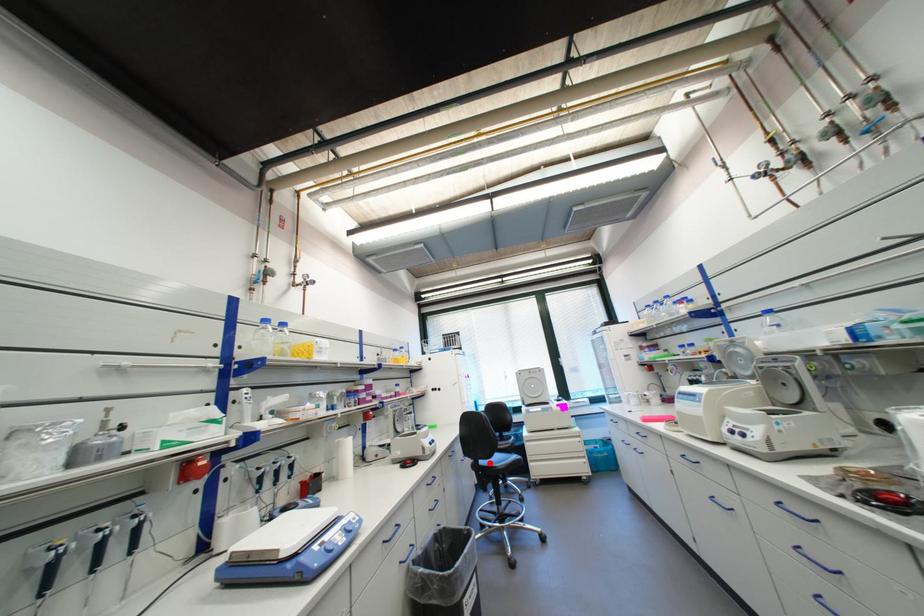
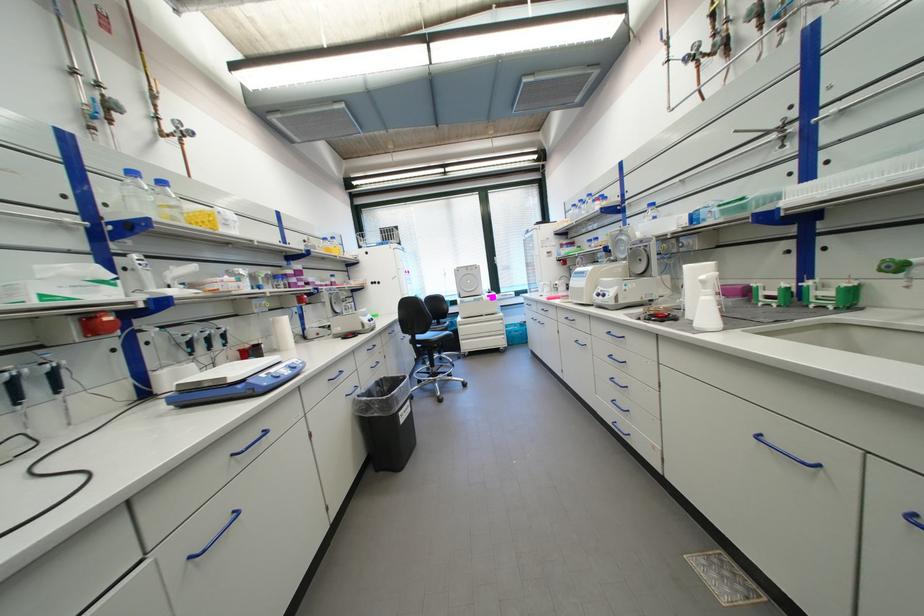
Question: I am providing you with two images of the same scene from different viewpoints. A red point is marked on the first image. Can you still see the location of the red point in image 2?

Choices:
 (A) Yes
 (B) No

Answer: (A)